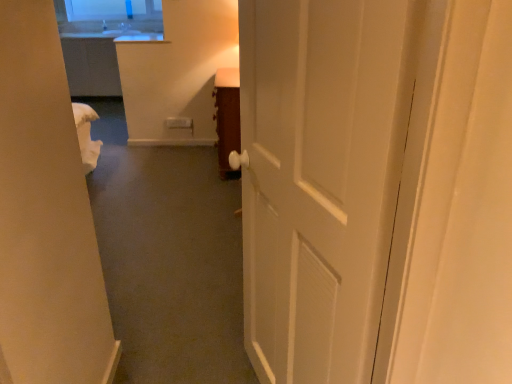
Question: From the image's perspective, is white glossy door at center above or below wooden cabinet at center?

Choices:
 (A) above
 (B) below

Answer: (B)

Question: From a real-world perspective, relative to wooden cabinet at center, is white glossy door at center vertically above or below?

Choices:
 (A) above
 (B) below

Answer: (A)

Question: Is white glossy door at center taller or shorter than wooden cabinet at center?

Choices:
 (A) tall
 (B) short

Answer: (A)

Question: Considering the positions of wooden cabinet at center and white glossy door at center in the image, is wooden cabinet at center wider or thinner than white glossy door at center?

Choices:
 (A) thin
 (B) wide

Answer: (B)

Question: In terms of size, does wooden cabinet at center appear bigger or smaller than white glossy door at center?

Choices:
 (A) small
 (B) big

Answer: (A)

Question: Is point (236, 74) positioned closer to the camera than point (294, 119)?

Choices:
 (A) closer
 (B) farther

Answer: (B)

Question: From a real-world perspective, is wooden cabinet at center above or below white glossy door at center?

Choices:
 (A) above
 (B) below

Answer: (B)